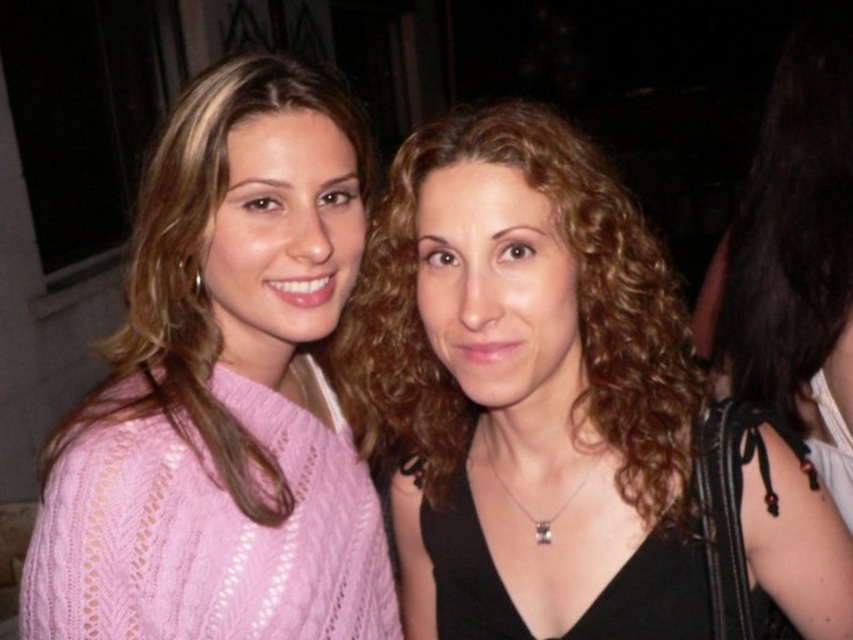
Question: Which of the following is the farthest from the observer?

Choices:
 (A) pink knitted sweater at center
 (B) matte black top at center

Answer: (A)

Question: Where is matte black top at center located in relation to pink knitted sweater at center in the image?

Choices:
 (A) below
 (B) above

Answer: (A)

Question: Can you confirm if matte black top at center is positioned above pink knitted sweater at center?

Choices:
 (A) no
 (B) yes

Answer: (A)

Question: Which object appears closest to the camera in this image?

Choices:
 (A) matte black top at center
 (B) pink knitted sweater at center

Answer: (A)

Question: Can you confirm if matte black top at center is positioned above pink knitted sweater at center?

Choices:
 (A) no
 (B) yes

Answer: (A)

Question: Which point is closer to the camera taking this photo?

Choices:
 (A) (198, 506)
 (B) (556, 204)

Answer: (B)